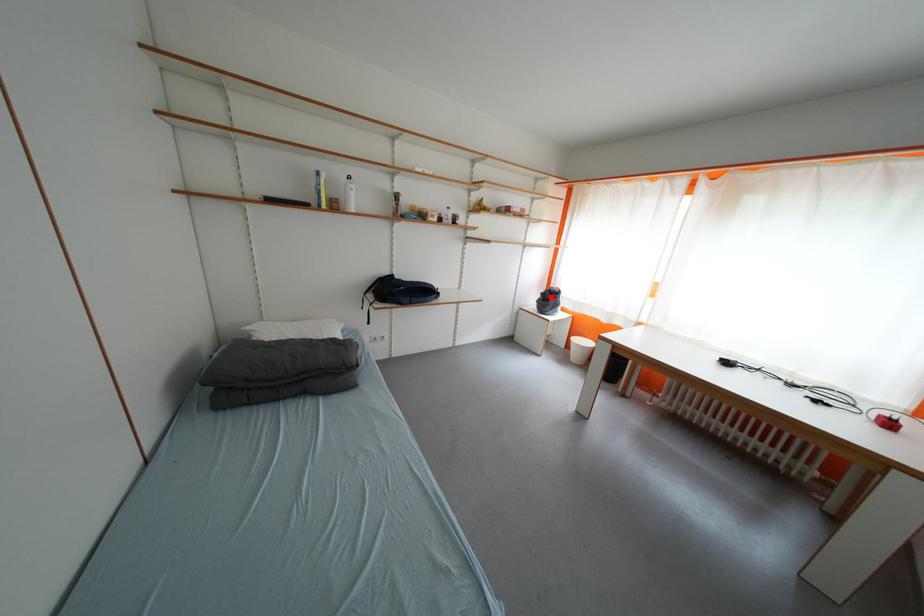
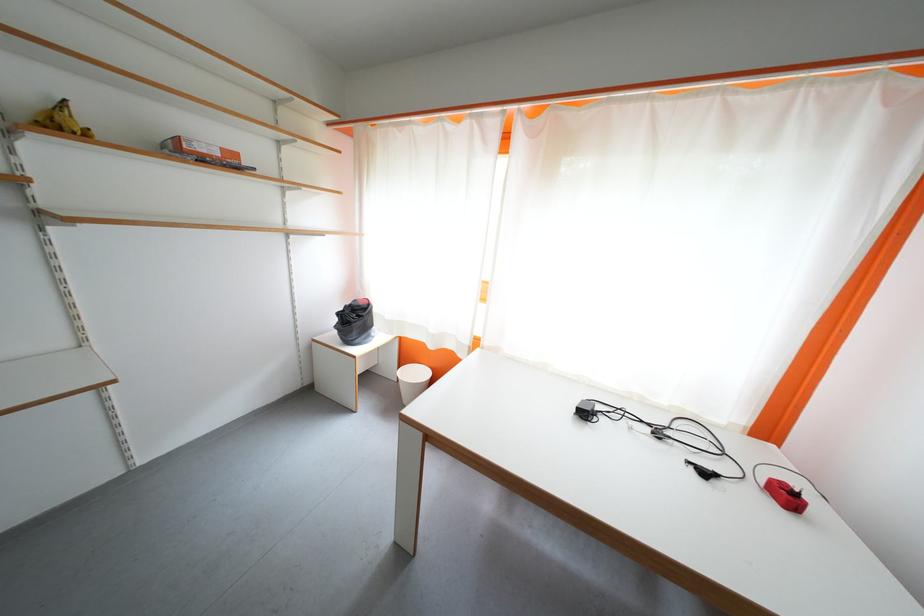
Question: A red point is marked in image1. In image2, is the corresponding 3D point closer to the camera or farther? Reply with the corresponding letter.

Choices:
 (A) The corresponding 3D point is closer.
 (B) The corresponding 3D point is farther.

Answer: (B)